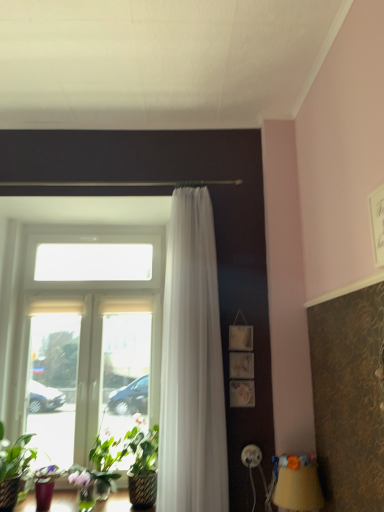
Question: Considering the positions of point (286, 505) and point (220, 446), is point (286, 505) closer or farther from the camera than point (220, 446)?

Choices:
 (A) farther
 (B) closer

Answer: (B)

Question: Is yellow fabric lampshade at lower right taller or shorter than white sheer curtain at center?

Choices:
 (A) short
 (B) tall

Answer: (A)

Question: Which object is the farthest from the white sheer curtain at center?

Choices:
 (A) green leafy plant at lower left
 (B) yellow fabric lampshade at lower right
 (C) clear glass window at center

Answer: (A)

Question: Which of these objects is positioned closest to the green leafy plant at lower left?

Choices:
 (A) white sheer curtain at center
 (B) yellow fabric lampshade at lower right
 (C) clear glass window at center

Answer: (C)